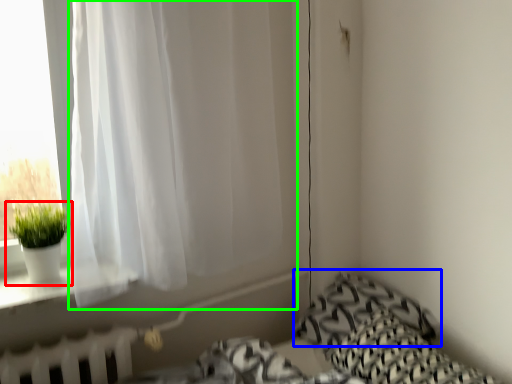
Question: Considering the real-world distances, which object is farthest from houseplant (highlighted by a red box)? pillow (highlighted by a blue box) or curtain (highlighted by a green box)?

Choices:
 (A) pillow
 (B) curtain

Answer: (A)